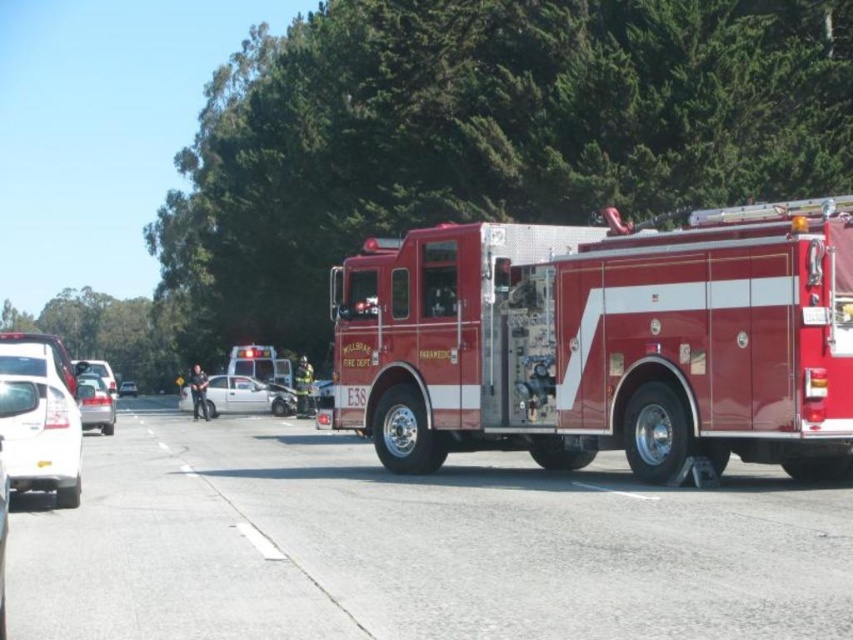
Question: Which point appears farthest from the camera in this image?

Choices:
 (A) (135, 390)
 (B) (105, 429)

Answer: (A)

Question: Can you confirm if white glossy sedan at lower left is positioned above white glossy sedan at center?

Choices:
 (A) no
 (B) yes

Answer: (B)

Question: Can you confirm if shiny red fire truck at center is wider than silver metallic sedan at center?

Choices:
 (A) no
 (B) yes

Answer: (B)

Question: Which point is farther from the camera taking this photo?

Choices:
 (A) (42, 433)
 (B) (102, 429)
 (C) (703, 433)
 (D) (119, 392)

Answer: (D)

Question: Based on their relative distances, which object is farther from the shiny red fire truck at center?

Choices:
 (A) white glossy sedan at center
 (B) white glossy sedan at lower left

Answer: (A)

Question: Is shiny red fire truck at center thinner than white glossy sedan at center?

Choices:
 (A) no
 (B) yes

Answer: (A)